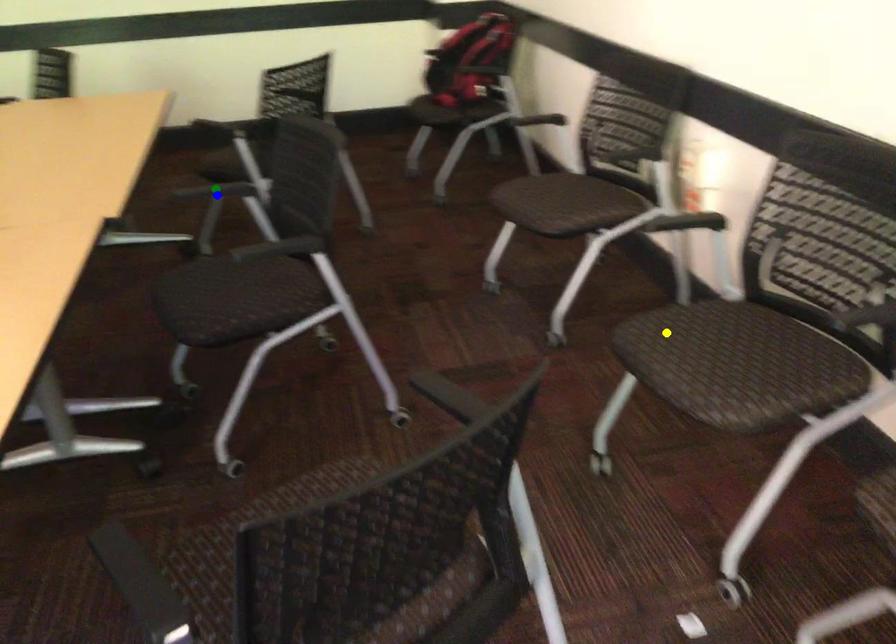
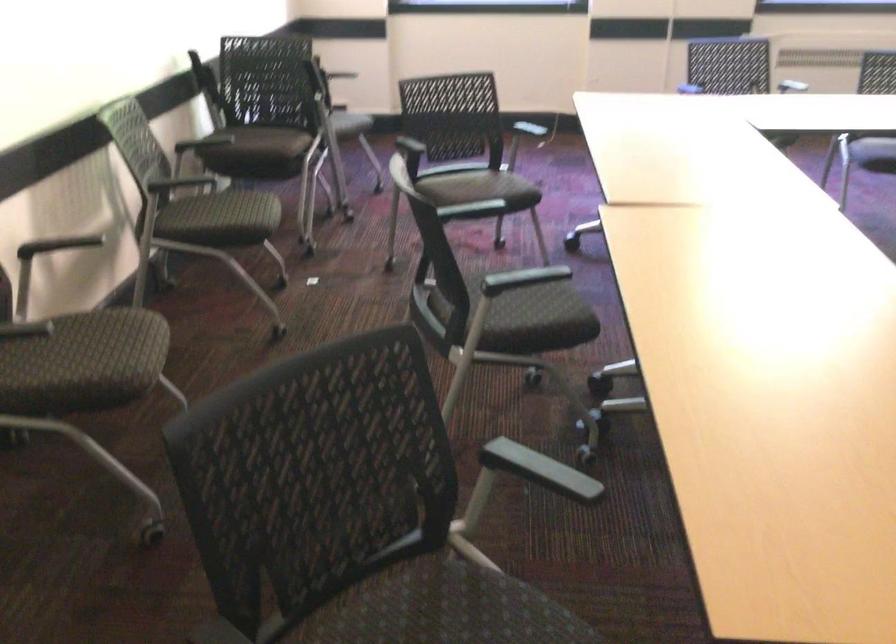
I am providing you with two images of the same scene from different viewpoints. Three points are marked in image1. Which point corresponds to a part or object that is occluded in image2?In image1, three points are marked. Which of them correspond to a part or object that is occluded in image2?Among the three points shown in image1, which one corresponds to a part or object that is no longer visible due to occlusion in image2?

Invisible in image2: green point.